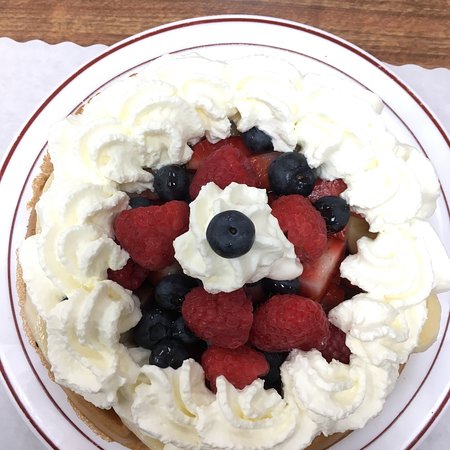
In order to click on plate in this screenshot , I will do `click(411, 418)`.